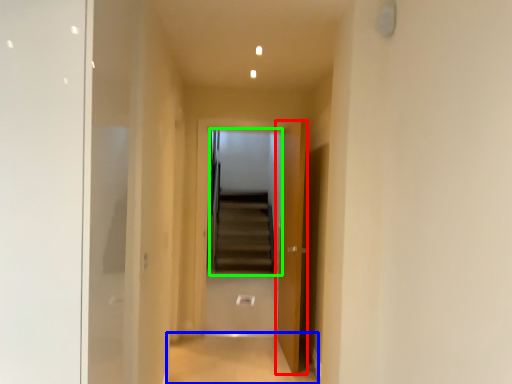
Question: Which is farther away from door (highlighted by a red box)? path (highlighted by a blue box) or escalator (highlighted by a green box)?

Choices:
 (A) path
 (B) escalator

Answer: (B)